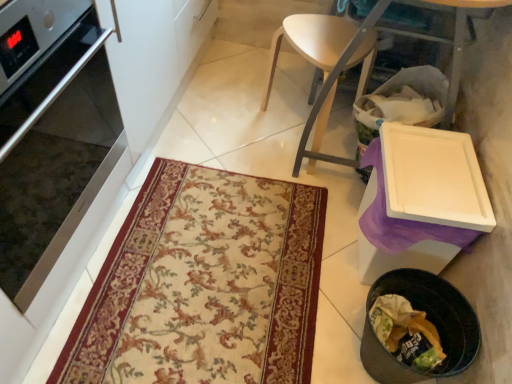
This screenshot has height=384, width=512. I want to click on vacant area that lies in front of white plastic cutting board at right, so click(265, 256).